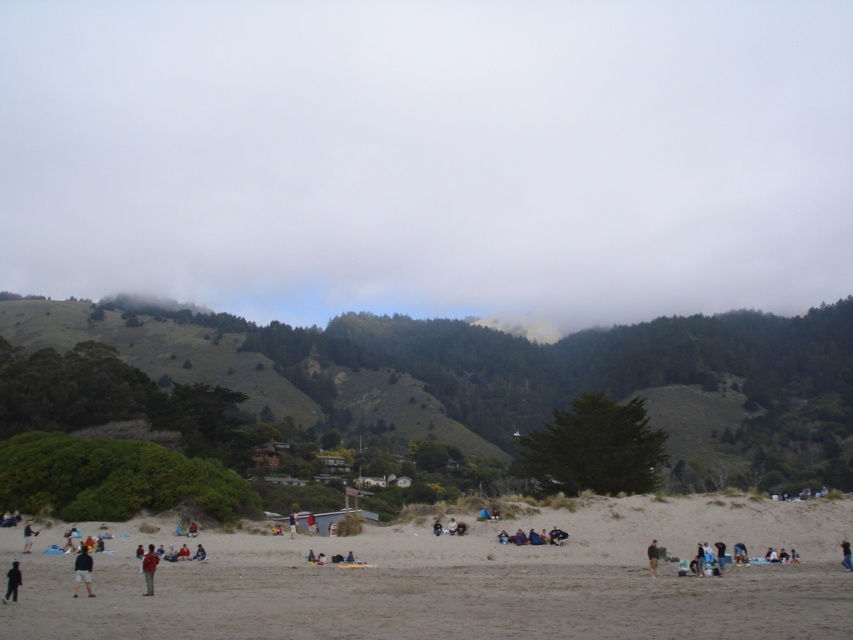
Question: Estimate the real-world distances between objects in this image. Which object is farther from the dark gray fabric jacket at lower left?

Choices:
 (A) dark gray fabric person at lower left
 (B) white fluffy cloud at upper center
 (C) dark brown leather jacket at lower right
 (D) red fabric jacket at lower left

Answer: (B)

Question: Is dark brown leather jacket at lower right bigger than dark blue jeans at lower center?

Choices:
 (A) yes
 (B) no

Answer: (B)

Question: Is dark gray fabric jacket at lower left thinner than dark gray fabric person at lower left?

Choices:
 (A) yes
 (B) no

Answer: (A)

Question: Which object is farther from the camera taking this photo?

Choices:
 (A) green grassy hillside at center
 (B) light brown sand at center
 (C) dark gray pants at lower left
 (D) dark gray fabric jacket at lower left

Answer: (A)

Question: Among these objects, which one is farthest from the camera?

Choices:
 (A) light brown sand at center
 (B) dark gray pants at lower left
 (C) dark gray fabric person at lower left

Answer: (B)

Question: Does dark gray fabric person at lower left appear over dark blue jeans at lower center?

Choices:
 (A) no
 (B) yes

Answer: (B)